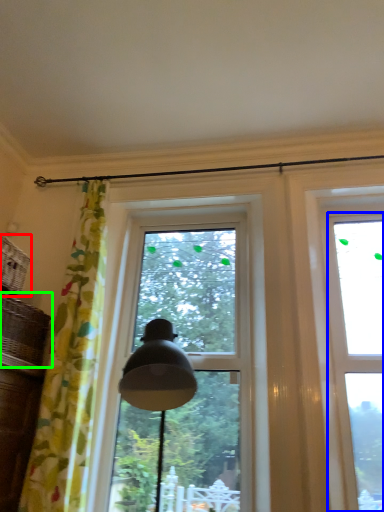
Question: Which object is positioned farthest from basket (highlighted by a red box)? Select from window (highlighted by a blue box) and basket (highlighted by a green box).

Choices:
 (A) window
 (B) basket

Answer: (A)